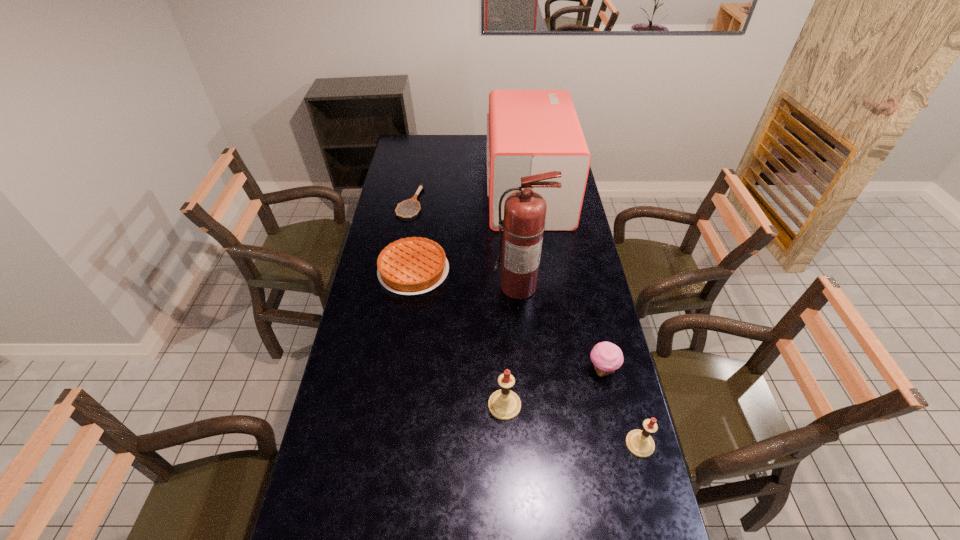
The height and width of the screenshot is (540, 960). I want to click on the third tallest object, so click(504, 404).

The image size is (960, 540). Find the location of `the sixth farthest object`. the sixth farthest object is located at coordinates 504,404.

This screenshot has width=960, height=540. What are the coordinates of `the fourth shortest object` in the screenshot? It's located at (640, 443).

Image resolution: width=960 pixels, height=540 pixels. Identify the location of the right candle. (640, 443).

Identify the location of fire extinguisher. The image size is (960, 540). (523, 225).

The width and height of the screenshot is (960, 540). In order to click on box in this screenshot , I will do `click(529, 132)`.

Identify the location of the sixth tallest object. The width and height of the screenshot is (960, 540). 414,265.

Where is `tennis racket`? Image resolution: width=960 pixels, height=540 pixels. tennis racket is located at coordinates (421, 186).

You are a GUI agent. You are given a task and a screenshot of the screen. Output one action in this format:
    pyautogui.click(x=<x>, y=<y>)
    Task: Click on the cupcake
    
    Given the screenshot: What is the action you would take?
    pyautogui.click(x=607, y=357)

Find the location of a particular element. The image size is (960, 540). the fifth tallest object is located at coordinates click(x=607, y=357).